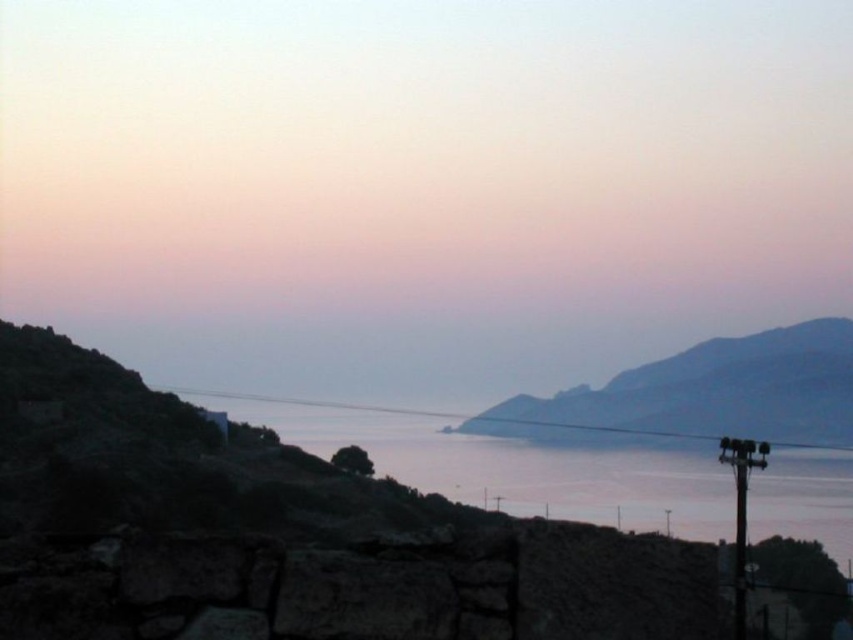
You are a hiker who wants to cross from the smooth gray rock at center to the clear water at center. The path between them is 9.18 meters. If your backpack weighs 10 kg and you can carry a maximum of 15 kg, can you safely make the crossing?

The clear water at center is 9.18 meters away from the smooth gray rock at center. Since your backpack is within the weight limit, you can safely cross the 9.18 meters distance.

Consider the image. You are standing at the shoreline and see the clear water at center and the smooth gray rock at center. Which object is closer to your right side?

The smooth gray rock at center is closer to your right side since the clear water at center is to the left of it.